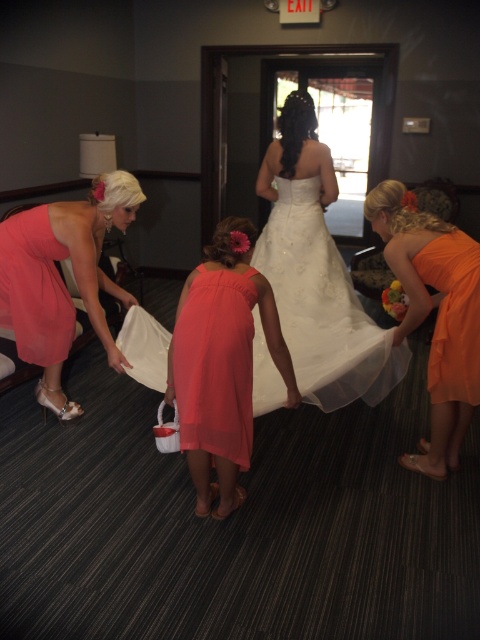
You are a photographer standing in the hotel room where the bride is preparing. You need to position yourself so that you can capture both the matte coral dress at center and the matte pink dress at left in the same frame. Given their height difference, which dress will appear larger in the photo?

The matte coral dress at center will appear larger in the photo because it is much taller than the matte pink dress at left.

You are standing in the hotel room where the bride is preparing for her wedding. You need to determine which of the two points, point (47, 266) or point (61, 289), is closer to you. Which one is it?

Point (47, 266) is closer to the camera than point (61, 289), so the point closer to you is point (47, 266).

You are standing in the hotel room where the bride is preparing for her wedding. You see a point marked at coordinates (216, 364). Which object does this point lie on?

The point at coordinates (216, 364) lies on the matte coral dress at center.